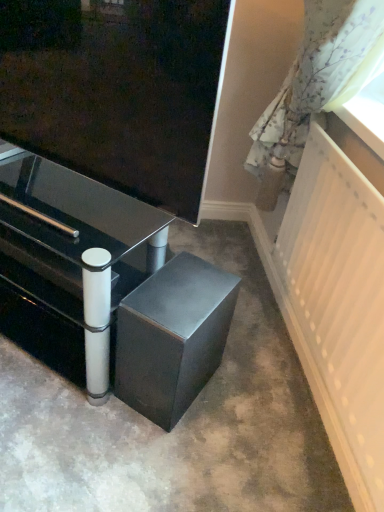
Where is `empty space that is ontop of satin black speaker at lower center (from a real-world perspective)`? empty space that is ontop of satin black speaker at lower center (from a real-world perspective) is located at coordinates [x=183, y=288].